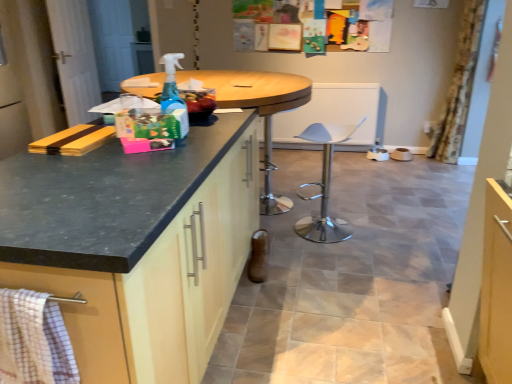
Question: Is floral fabric curtain at right in contact with matte black countertop at left?

Choices:
 (A) yes
 (B) no

Answer: (B)

Question: Considering the relative positions of floral fabric curtain at right and matte black countertop at left in the image provided, is floral fabric curtain at right in front of matte black countertop at left?

Choices:
 (A) no
 (B) yes

Answer: (A)

Question: Is matte black countertop at left a part of floral fabric curtain at right?

Choices:
 (A) no
 (B) yes

Answer: (A)

Question: Considering the relative positions of floral fabric curtain at right and matte black countertop at left in the image provided, is floral fabric curtain at right to the right of matte black countertop at left from the viewer's perspective?

Choices:
 (A) no
 (B) yes

Answer: (B)

Question: Is floral fabric curtain at right outside matte black countertop at left?

Choices:
 (A) no
 (B) yes

Answer: (B)

Question: Is floral fabric curtain at right taller than matte black countertop at left?

Choices:
 (A) no
 (B) yes

Answer: (B)

Question: Is wooden table at center in front of white wood screen door at left?

Choices:
 (A) yes
 (B) no

Answer: (A)

Question: From a real-world perspective, is wooden table at center located higher than white wood screen door at left?

Choices:
 (A) no
 (B) yes

Answer: (A)

Question: Is wooden table at center far from white wood screen door at left?

Choices:
 (A) no
 (B) yes

Answer: (B)

Question: Is wooden table at center at the right side of white wood screen door at left?

Choices:
 (A) no
 (B) yes

Answer: (B)

Question: Does wooden table at center have a lesser width compared to white wood screen door at left?

Choices:
 (A) no
 (B) yes

Answer: (A)

Question: From the image's perspective, is wooden table at center located beneath white wood screen door at left?

Choices:
 (A) yes
 (B) no

Answer: (A)

Question: Considering the relative sizes of checkered fabric towel at lower left and matte black countertop at left in the image provided, is checkered fabric towel at lower left bigger than matte black countertop at left?

Choices:
 (A) no
 (B) yes

Answer: (A)